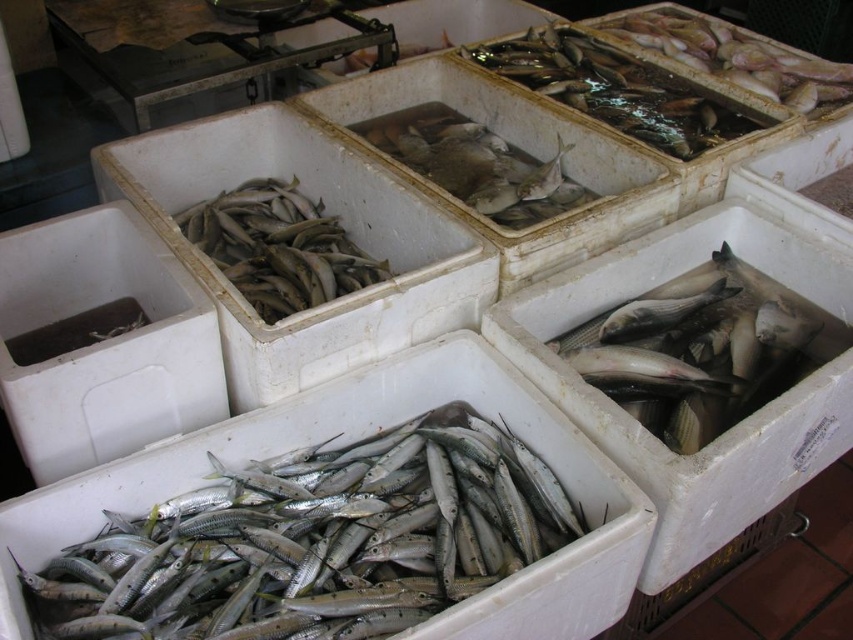
Question: Which object is positioned closest to the silvery metallic fish at upper left?

Choices:
 (A) silvery-scaled fish at center
 (B) shiny silver fish at upper right
 (C) silver metallic fish at lower left
 (D) shiny silver fish at center

Answer: (A)

Question: Does silver metallic fish at lower left appear on the left side of silvery metallic fish at upper left?

Choices:
 (A) no
 (B) yes

Answer: (A)

Question: Can you confirm if shiny silver fish at center is smaller than silvery-scaled fish at center?

Choices:
 (A) yes
 (B) no

Answer: (B)

Question: Which of the following is the farthest from the observer?

Choices:
 (A) (283, 208)
 (B) (585, 106)

Answer: (B)

Question: Among these points, which one is farthest from the camera?

Choices:
 (A) click(712, 436)
 (B) click(115, 589)
 (C) click(685, 157)
 (D) click(247, 273)

Answer: (C)

Question: Can you confirm if silver metallic fish at lower left is positioned below shiny silver fish at center?

Choices:
 (A) no
 (B) yes

Answer: (B)